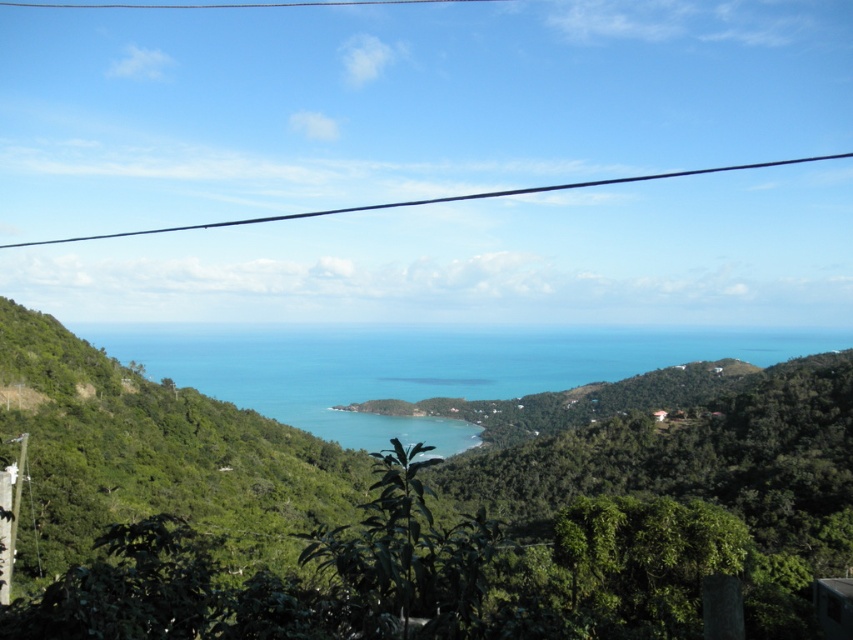
Question: Which of the following is the closest to the observer?

Choices:
 (A) blue water at center
 (B) black wire at upper center

Answer: (A)

Question: Which point is closer to the camera taking this photo?

Choices:
 (A) (498, 346)
 (B) (422, 200)

Answer: (A)

Question: Which of the following is the closest to the observer?

Choices:
 (A) (311, 432)
 (B) (608, 180)

Answer: (A)

Question: Does blue water at center appear on the right side of black wire at upper center?

Choices:
 (A) no
 (B) yes

Answer: (B)

Question: Can you confirm if blue water at center is wider than black wire at upper center?

Choices:
 (A) yes
 (B) no

Answer: (B)

Question: Considering the relative positions of blue water at center and black wire at upper center in the image provided, where is blue water at center located with respect to black wire at upper center?

Choices:
 (A) above
 (B) below

Answer: (B)